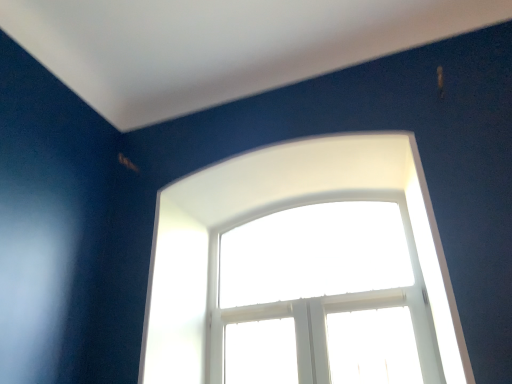
Locate an element on the screen. This screenshot has width=512, height=384. white glossy window at center is located at coordinates (270, 212).

Measure the distance between point (431, 206) and camera.

Point (431, 206) and camera are 1.95 meters apart from each other.

The image size is (512, 384). What do you see at coordinates (270, 212) in the screenshot?
I see `white glossy window at center` at bounding box center [270, 212].

Find the location of `white glossy window at center`. white glossy window at center is located at coordinates (270, 212).